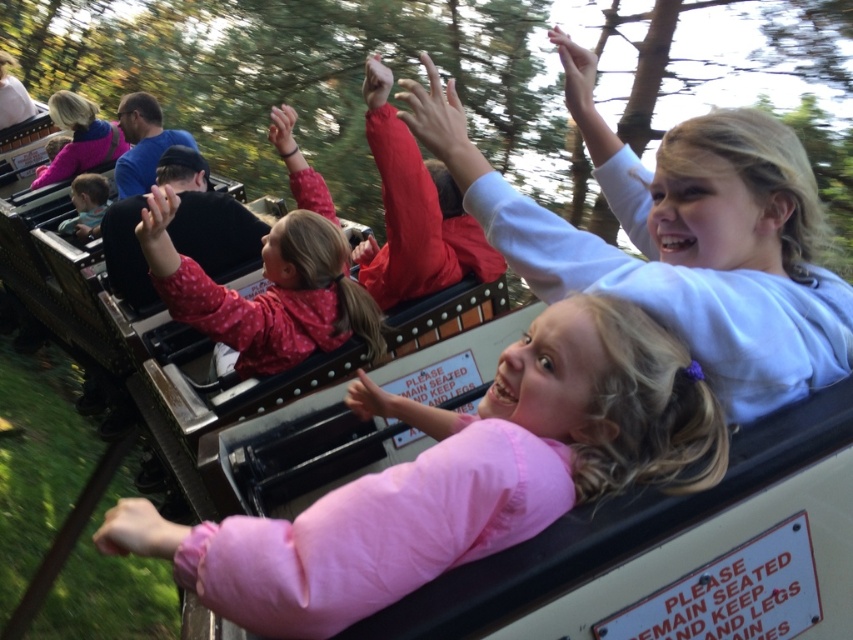
Where is the pink dotted jacket at center located in the image?

The pink dotted jacket at center is located at point (x=265, y=291) in the image.

You are a park safety inspector checking the roller coaster car. You notice two pink items in the car. The first is a pink fabric at center, and the second is a matte pink jacket at upper left. Which of these items takes up more space in the roller coaster car?

The matte pink jacket at upper left takes up more space in the roller coaster car than the pink fabric at center because the pink fabric at center occupies less space than matte pink jacket at upper left.